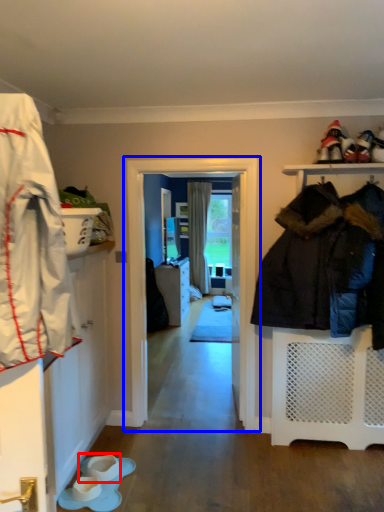
Question: Which object appears farthest to the camera in this image, footwear (highlighted by a red box) or screen door (highlighted by a blue box)?

Choices:
 (A) footwear
 (B) screen door

Answer: (B)